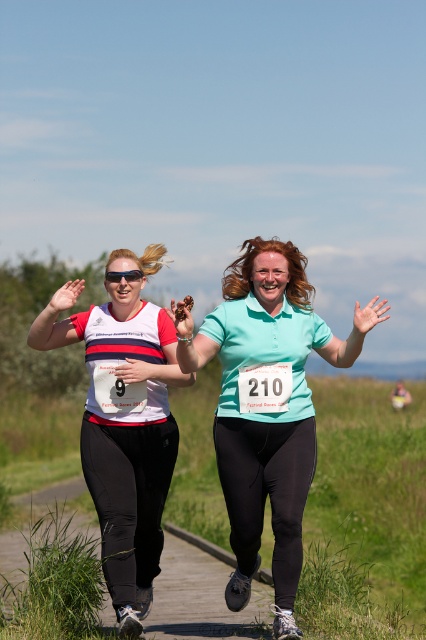
Question: Is white matte shirt at center above black plastic goggles at center?

Choices:
 (A) no
 (B) yes

Answer: (A)

Question: Considering the relative positions of teal matte shirt at center and black plastic goggles at center in the image provided, where is teal matte shirt at center located with respect to black plastic goggles at center?

Choices:
 (A) below
 (B) above

Answer: (A)

Question: Is teal matte shirt at center to the left of white matte shirt at center from the viewer's perspective?

Choices:
 (A) yes
 (B) no

Answer: (B)

Question: Which object appears farthest from the camera in this image?

Choices:
 (A) black plastic goggles at center
 (B) teal matte shirt at center
 (C) white matte shirt at center

Answer: (A)

Question: Which point is farther to the camera?

Choices:
 (A) black plastic goggles at center
 (B) white matte shirt at center
 (C) teal matte shirt at center

Answer: (A)

Question: Which of the following is the farthest from the observer?

Choices:
 (A) (126, 276)
 (B) (239, 586)

Answer: (B)